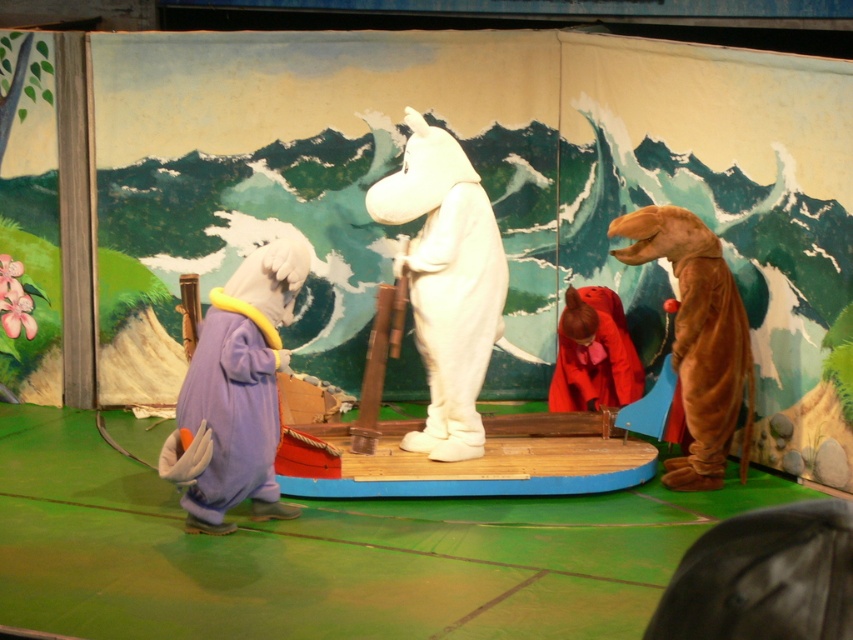
Question: Is purple plush elephant at left positioned behind brown furry dinosaur at right?

Choices:
 (A) no
 (B) yes

Answer: (A)

Question: Which object is positioned closest to the brown furry dinosaur at right?

Choices:
 (A) white plush unicorn at center
 (B) purple plush elephant at left

Answer: (A)

Question: Can you confirm if brown furry dinosaur at right is positioned to the right of velvet red robe at center?

Choices:
 (A) yes
 (B) no

Answer: (A)

Question: Does purple plush elephant at left have a smaller size compared to velvet red robe at center?

Choices:
 (A) no
 (B) yes

Answer: (A)

Question: Which point appears farthest from the camera in this image?

Choices:
 (A) (265, 250)
 (B) (450, 364)

Answer: (B)

Question: Which object appears closest to the camera in this image?

Choices:
 (A) white plush unicorn at center
 (B) velvet red robe at center

Answer: (A)